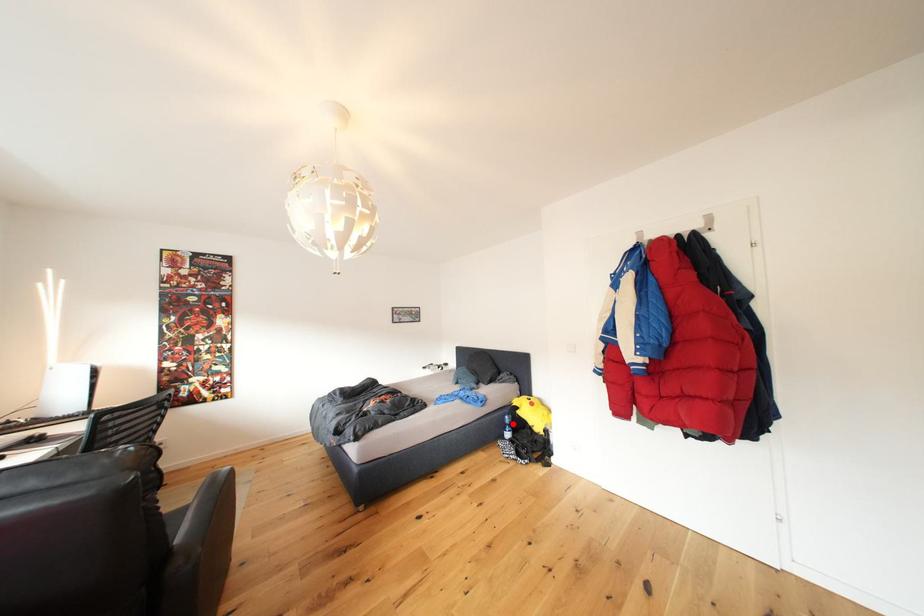
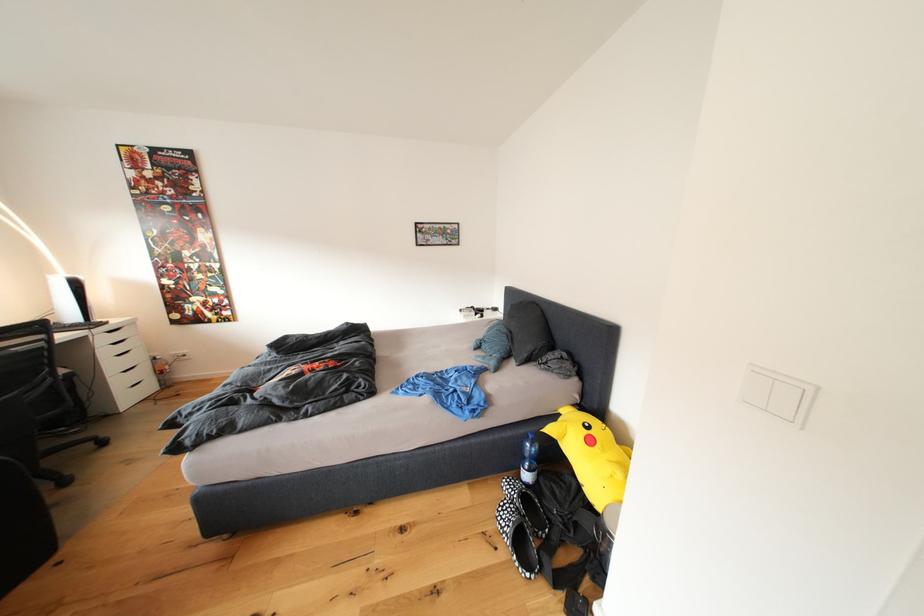
In the second image, find the point that corresponds to the highlighted location in the first image.

(531, 451)